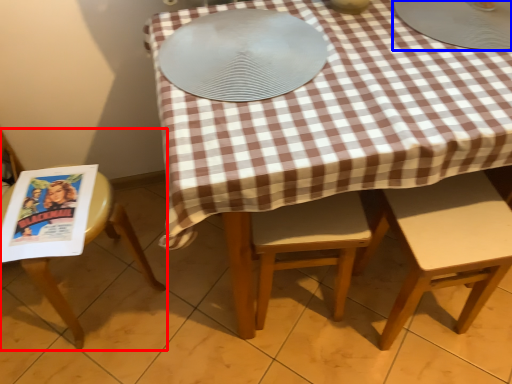
Question: Which of the following is the farthest to the observer, chair (highlighted by a red box) or tableware (highlighted by a blue box)?

Choices:
 (A) chair
 (B) tableware

Answer: (A)